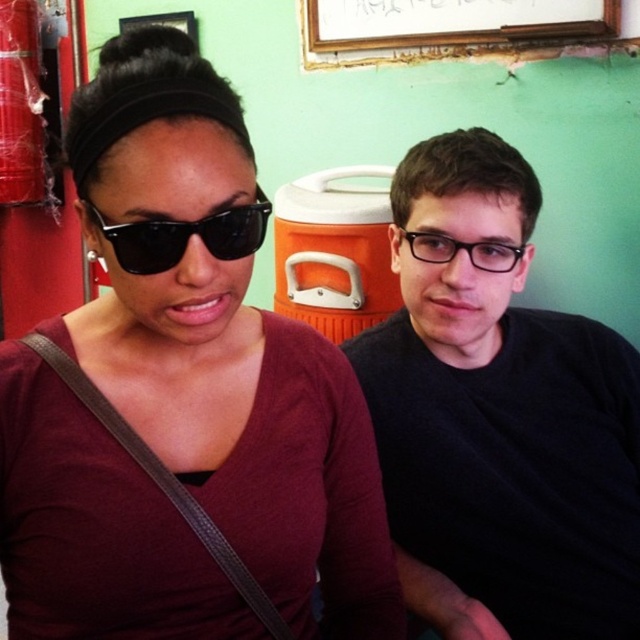
Question: Which point appears farthest from the camera in this image?

Choices:
 (A) (422, 250)
 (B) (620, 10)
 (C) (125, 230)

Answer: (B)

Question: Does matte black sunglasses at upper left appear under black matte glasses at upper right?

Choices:
 (A) no
 (B) yes

Answer: (A)

Question: Does black matte glasses at upper right have a lesser width compared to black plastic sunglasses at left?

Choices:
 (A) no
 (B) yes

Answer: (A)

Question: Which of the following is the farthest from the observer?

Choices:
 (A) matte black sunglasses at upper left
 (B) wooden frame at upper center
 (C) black matte glasses at upper right

Answer: (B)

Question: Which of the following is the farthest from the observer?

Choices:
 (A) (180, 241)
 (B) (467, 36)
 (C) (515, 253)
 (D) (426, 609)

Answer: (B)

Question: Is black matte glasses at upper right closer to the viewer compared to black plastic sunglasses at left?

Choices:
 (A) no
 (B) yes

Answer: (A)